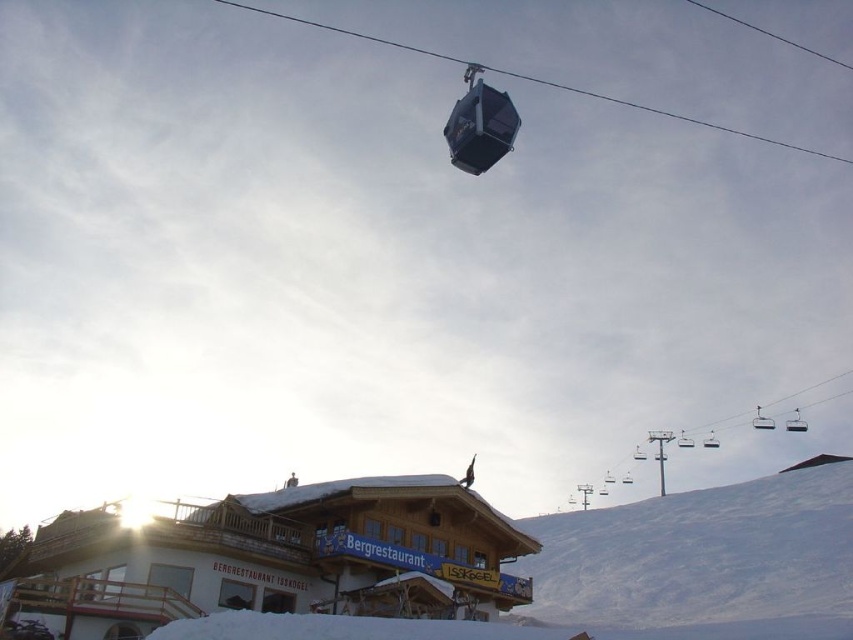
You are standing at the Bergrestaurant and want to take a photo of the gondola lift. You notice two points marked in the scene. Which point, point (410, 552) or point (566, 605), is closer to you when you take the photo?

Point (410, 552) is closer to the viewer than point (566, 605).

You are standing at the point marked by the coordinates point (x=276, y=557) in the snowy mountain scene. What structure are you currently located at?

The wooden cabin at lower center is represented by point (x=276, y=557), so you are located at the wooden cabin at lower center.